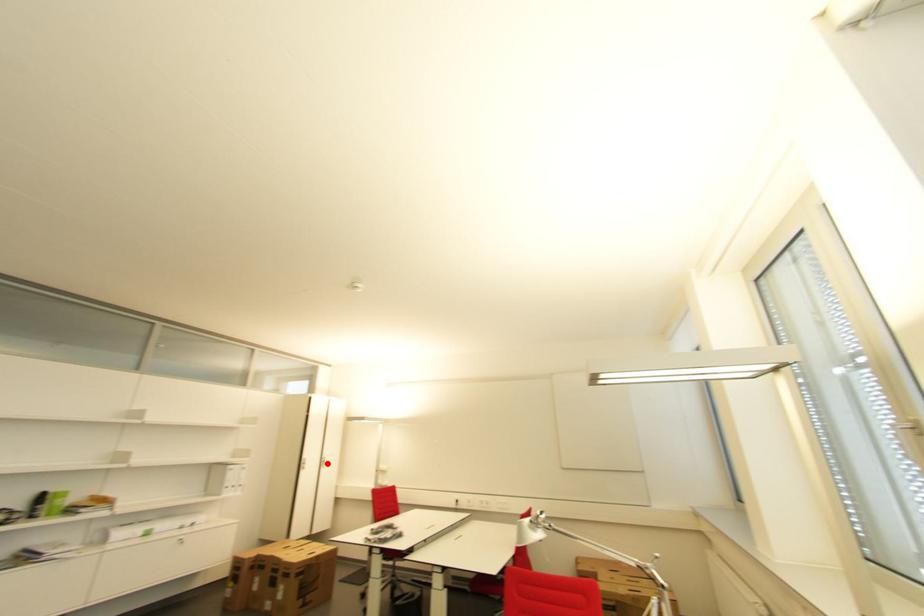
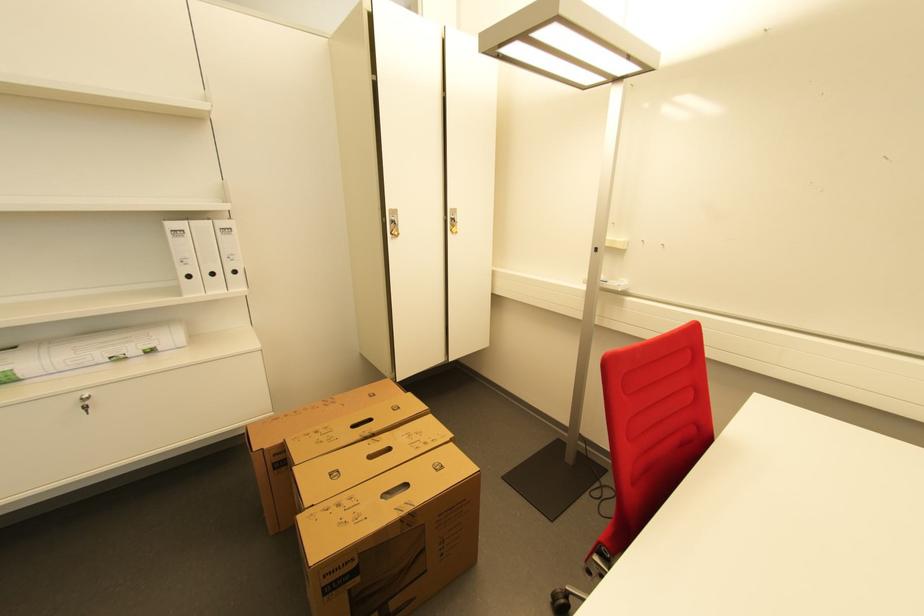
Find the pixel in the second image that matches the highlighted location in the first image.

(455, 223)